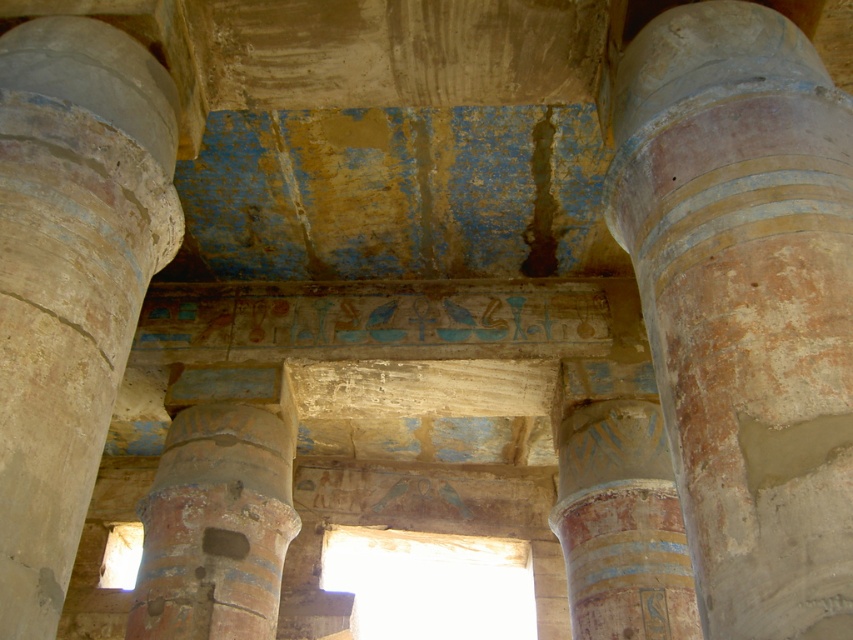
Question: Which point is farther from the camera taking this photo?

Choices:
 (A) (283, 538)
 (B) (244, 336)
 (C) (788, 401)

Answer: (B)

Question: Where is smooth stone column at left located in relation to rusty stone column at center in the image?

Choices:
 (A) below
 (B) above

Answer: (B)

Question: Observing the image, what is the correct spatial positioning of rusty stone column at center in reference to blue painted hieroglyphics at center?

Choices:
 (A) right
 (B) left

Answer: (B)

Question: Which object is farther from the camera taking this photo?

Choices:
 (A) blue painted hieroglyphics at center
 (B) smooth stone column at left

Answer: (A)

Question: Is speckled stone column at center wider than blue painted hieroglyphics at center?

Choices:
 (A) yes
 (B) no

Answer: (B)

Question: Which of these objects is positioned farthest from the blue painted hieroglyphics at center?

Choices:
 (A) smooth stone column at left
 (B) speckled stone column at center
 (C) rusty stone column at center

Answer: (A)